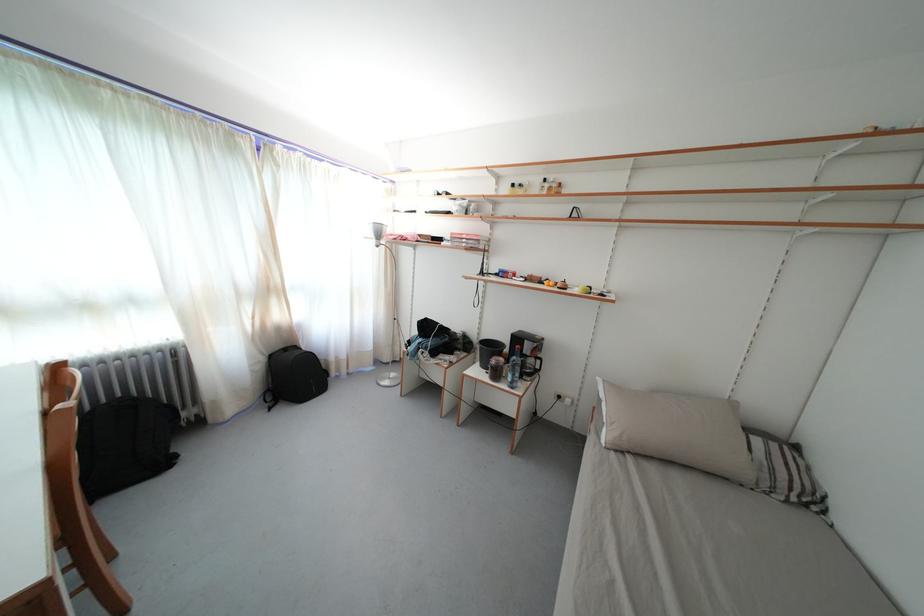
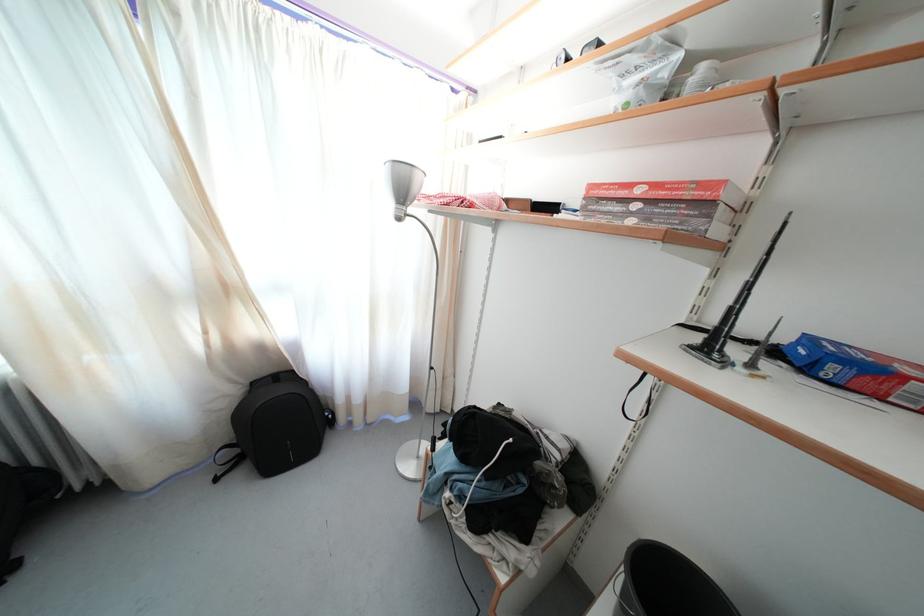
In the second image, find the point that corresponds to (469,241) in the first image.

(645, 197)